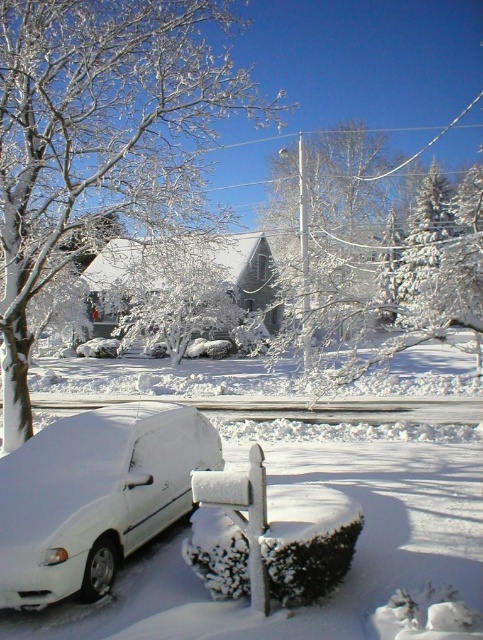
Identify the location of white fluffy snow at lower left. The height and width of the screenshot is (640, 483). (383, 524).

Does white fluffy snow at lower left come in front of snow-covered evergreen at upper right?

Yes, it is.

You are a GUI agent. You are given a task and a screenshot of the screen. Output one action in this format:
    pyautogui.click(x=<x>, y=<y>)
    Task: Click on the white fluffy snow at lower left
    
    Given the screenshot: What is the action you would take?
    pyautogui.click(x=383, y=524)

Find the location of a particular element. Image resolution: width=483 pixels, height=640 pixels. white fluffy snow at lower left is located at coordinates (383, 524).

Looking at this image, who is more forward, [37,275] or [84,605]?

Point [84,605]

Is white frosty tree at upper left wider than white fluffy snow at lower left?

No.

This screenshot has height=640, width=483. I want to click on white frosty tree at upper left, so click(100, 140).

Is white frosty tree at upper left taller than white matte car at lower left?

Correct, white frosty tree at upper left is much taller as white matte car at lower left.

Is point (0, 148) farther from camera compared to point (142, 540)?

That is True.

At what (x,y) coordinates should I click in order to perform the action: click on white frosty tree at upper left. Please return your answer as a coordinate pair (x, y). This screenshot has width=483, height=640. Looking at the image, I should click on (100, 140).